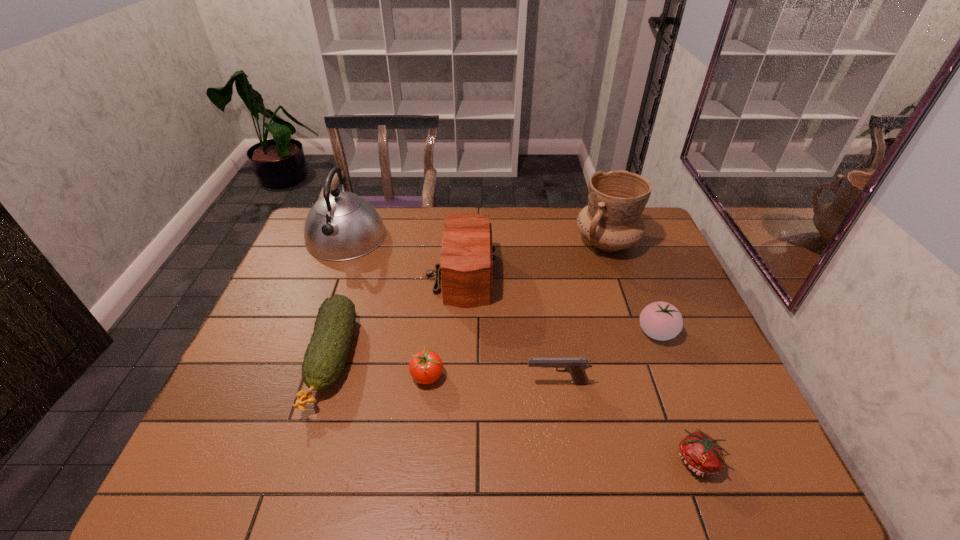
Find the location of `kettle`. kettle is located at coordinates (340, 226).

In order to click on pottery in this screenshot , I will do `click(612, 221)`.

The height and width of the screenshot is (540, 960). In order to click on the sixth shortest object in this screenshot , I will do `click(466, 268)`.

I want to click on the tallest tomato, so click(660, 320).

The height and width of the screenshot is (540, 960). Identify the location of cucumber. (325, 357).

Identify the location of pistol. Image resolution: width=960 pixels, height=540 pixels. (576, 367).

You are a GUI agent. You are given a task and a screenshot of the screen. Output one action in this format:
    pyautogui.click(x=<x>, y=<y>)
    Task: Click on the second farthest tomato
    
    Given the screenshot: What is the action you would take?
    pyautogui.click(x=425, y=367)

At what (x,y) coordinates should I click in order to perform the action: click on the nearest object. Please return your answer as a coordinate pair (x, y). Looking at the image, I should click on (699, 452).

This screenshot has height=540, width=960. What are the coordinates of `vacant space located 0.350m from the spout of the kettle` in the screenshot? It's located at (303, 349).

This screenshot has height=540, width=960. I want to click on vacant point located 0.290m on the left of the pottery, so click(490, 242).